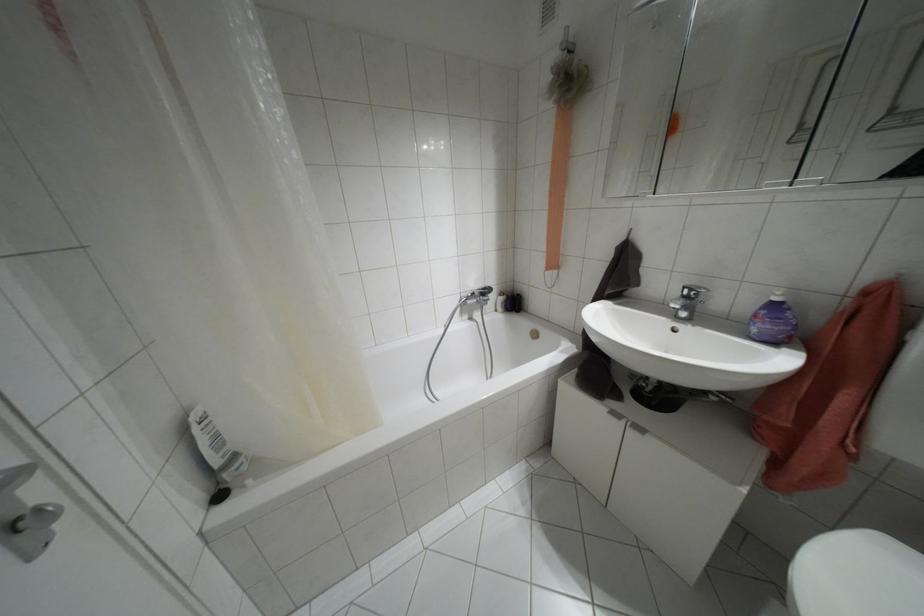
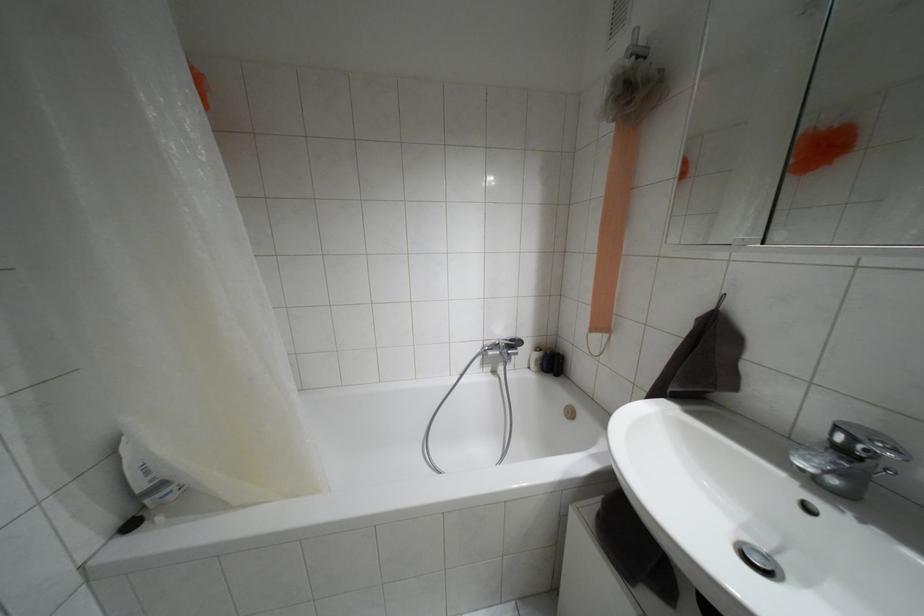
The images are taken continuously from a first-person perspective. In which direction are you moving?

The movement direction of the cameraman is right, forward.